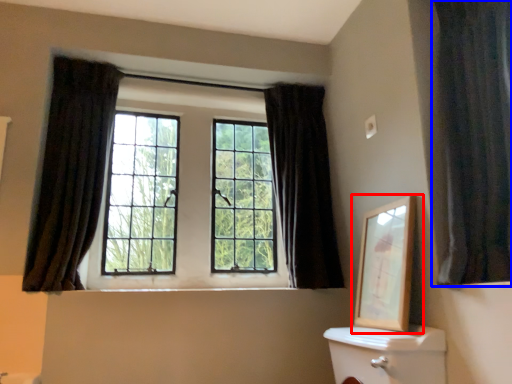
Question: Which object is closer to the camera taking this photo, picture frame (highlighted by a red box) or curtain (highlighted by a blue box)?

Choices:
 (A) picture frame
 (B) curtain

Answer: (B)